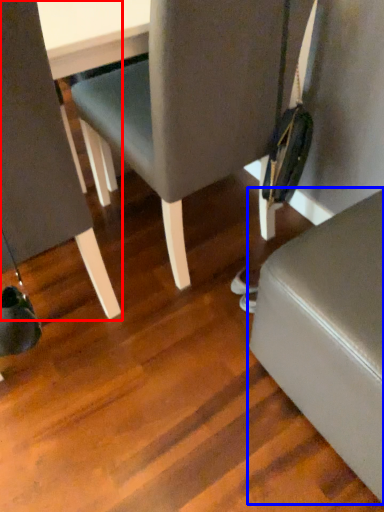
Question: Which of the following is the closest to the observer, chair (highlighted by a red box) or furniture (highlighted by a blue box)?

Choices:
 (A) chair
 (B) furniture

Answer: (A)